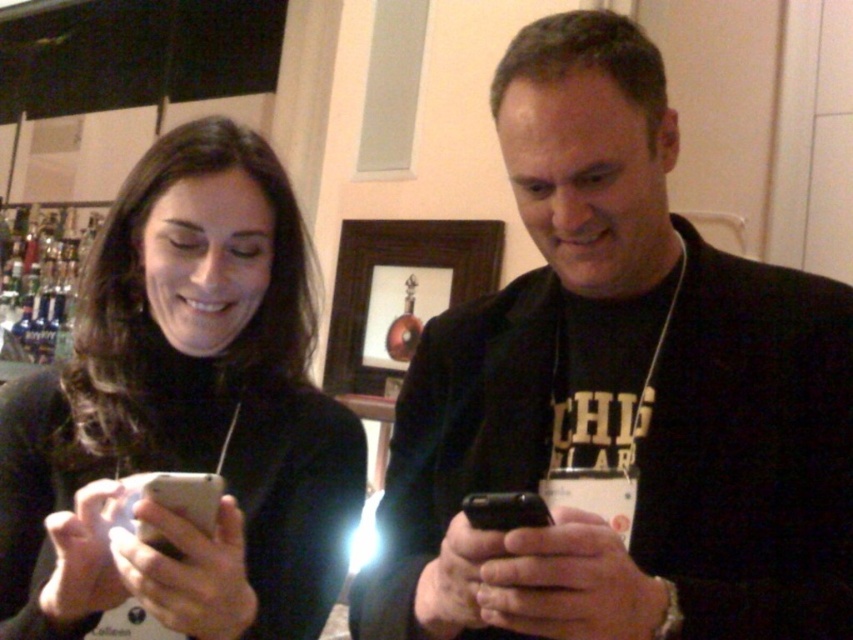
You are trying to place both the matte black phone at left and the black glossy smartphone at center into a phone case that can only accommodate a width of 7.5 centimeters. Based on their widths, can both fit individually into the case?

The matte black phone at left might be wider than black glossy smartphone at center. Since the case can only hold up to 7.5 centimeters, if the matte black phone at left is indeed wider than the black glossy smartphone at center, then the matte black phone at left might not fit, but the black glossy smartphone at center could fit if its width is under 7.5 cm. However, without exact measurements, we cannot be certain.